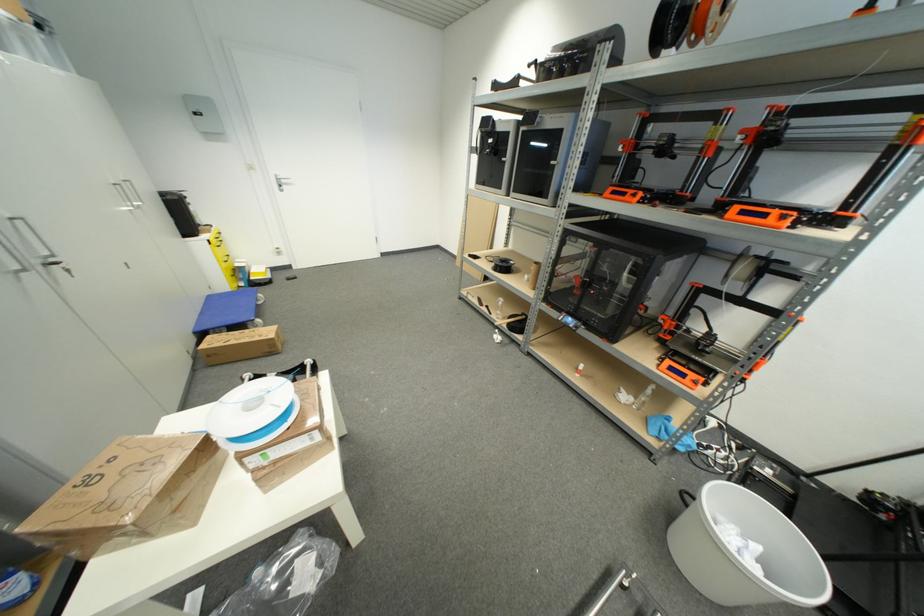
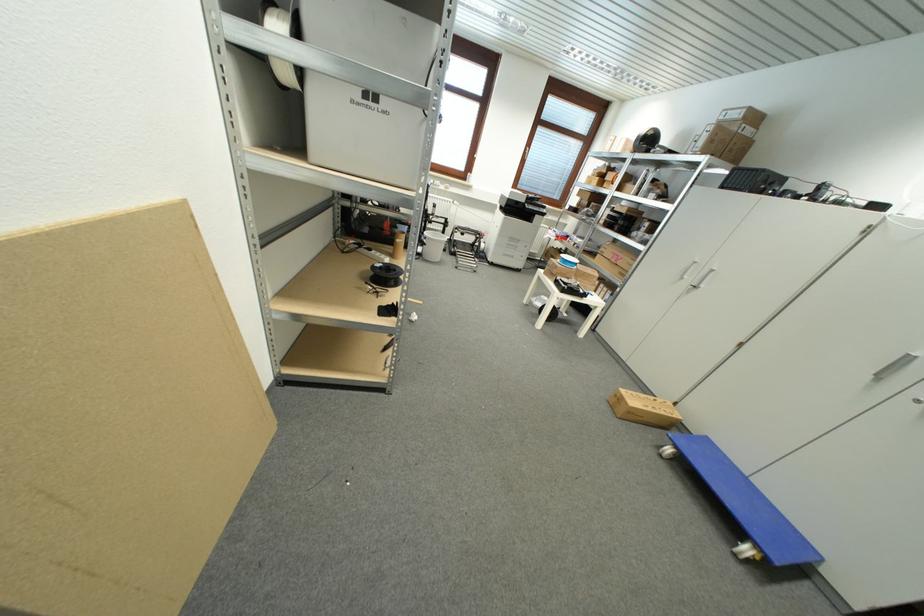
Where in the second image is the point corresponding to point 199,334 from the first image?

(711, 440)